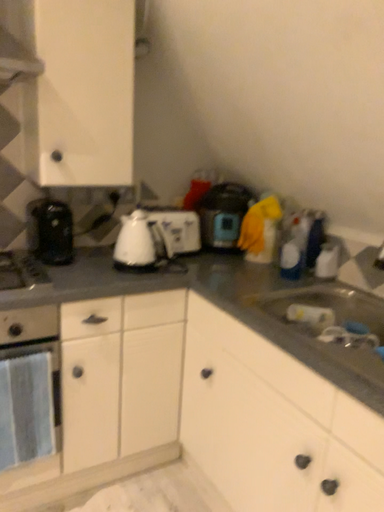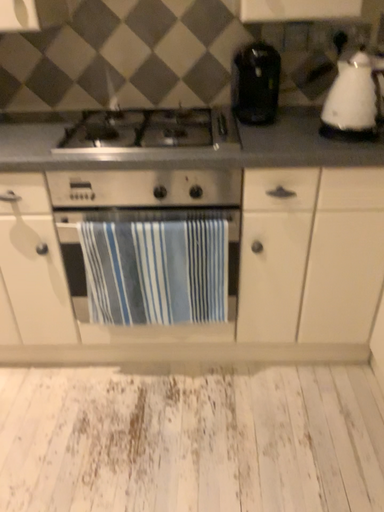
Question: How did the camera likely rotate when shooting the video?

Choices:
 (A) rotated downward
 (B) rotated upward

Answer: (A)